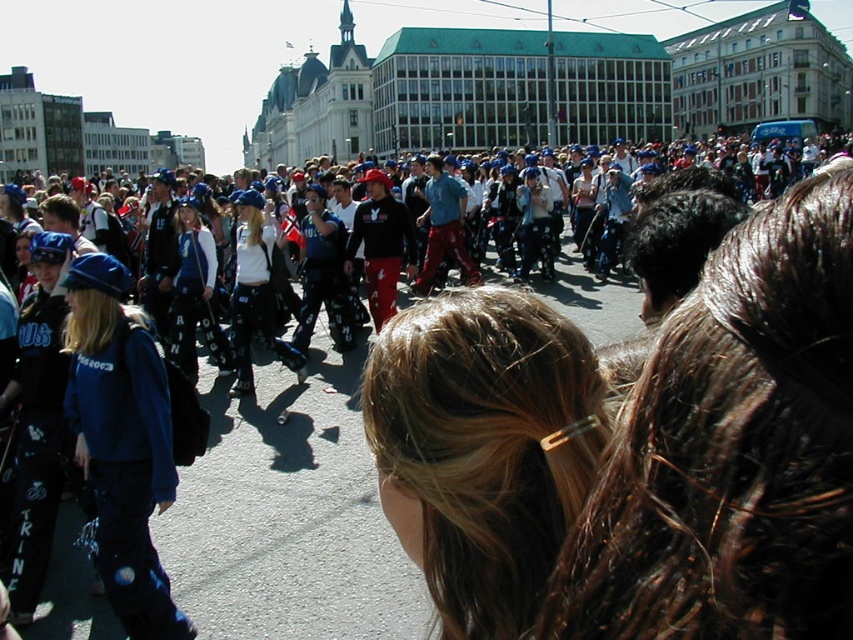
You are standing at the center of the street and want to take a photo of the brown hair at center. Which direction should you face to capture it in your camera view?

The brown hair at center is located at point (483, 448), so you should face towards the upper right direction to capture it in your camera view.